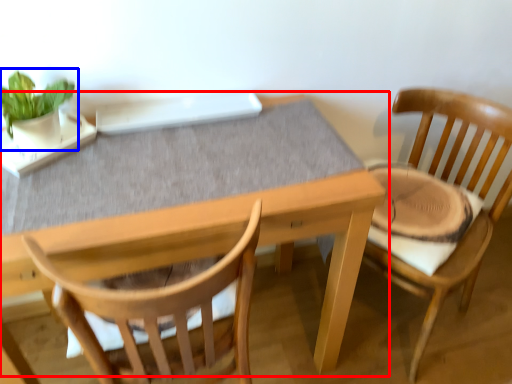
Question: Which object is further to the camera taking this photo, table (highlighted by a red box) or houseplant (highlighted by a blue box)?

Choices:
 (A) table
 (B) houseplant

Answer: (B)